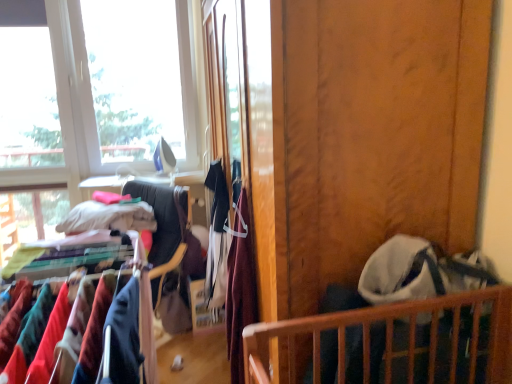
Question: Is wooden crib at lower right to the left of wooden screen door at center from the viewer's perspective?

Choices:
 (A) yes
 (B) no

Answer: (B)

Question: Would you say wooden crib at lower right contains wooden screen door at center?

Choices:
 (A) no
 (B) yes

Answer: (A)

Question: Can you confirm if wooden crib at lower right is thinner than wooden screen door at center?

Choices:
 (A) yes
 (B) no

Answer: (A)

Question: Does wooden crib at lower right have a greater height compared to wooden screen door at center?

Choices:
 (A) no
 (B) yes

Answer: (A)

Question: Is wooden crib at lower right looking in the opposite direction of wooden screen door at center?

Choices:
 (A) no
 (B) yes

Answer: (A)

Question: Can you see wooden crib at lower right touching wooden screen door at center?

Choices:
 (A) no
 (B) yes

Answer: (A)

Question: From the image's perspective, would you say velvet fabric clothes at center is shown under white cotton shirt at center, the 2th clothing from the right?

Choices:
 (A) yes
 (B) no

Answer: (A)

Question: From a real-world perspective, is velvet fabric clothes at center physically below white cotton shirt at center, which is counted as the 1th clothing, starting from the left?

Choices:
 (A) no
 (B) yes

Answer: (B)

Question: Is velvet fabric clothes at center thinner than white cotton shirt at center, which is counted as the 1th clothing, starting from the left?

Choices:
 (A) no
 (B) yes

Answer: (A)

Question: Is velvet fabric clothes at center at the left side of white cotton shirt at center, arranged as the 2th clothing when viewed from the front?

Choices:
 (A) no
 (B) yes

Answer: (B)

Question: Can you confirm if velvet fabric clothes at center is shorter than white cotton shirt at center, which is counted as the 1th clothing, starting from the left?

Choices:
 (A) yes
 (B) no

Answer: (B)

Question: Is velvet fabric clothes at center facing away from white cotton shirt at center, arranged as the 2th clothing when viewed from the front?

Choices:
 (A) no
 (B) yes

Answer: (A)

Question: Is wooden screen door at center further to the viewer compared to wooden crib at lower right?

Choices:
 (A) no
 (B) yes

Answer: (A)